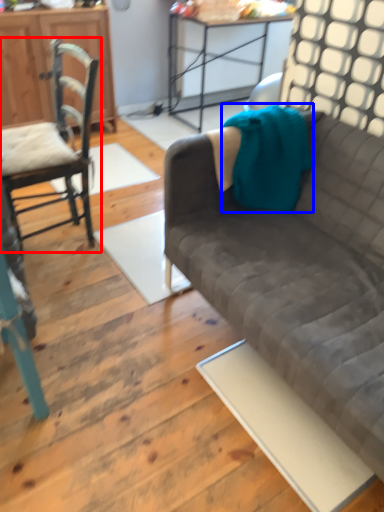
Question: Among these objects, which one is farthest to the camera, chair (highlighted by a red box) or blanket (highlighted by a blue box)?

Choices:
 (A) chair
 (B) blanket

Answer: (B)